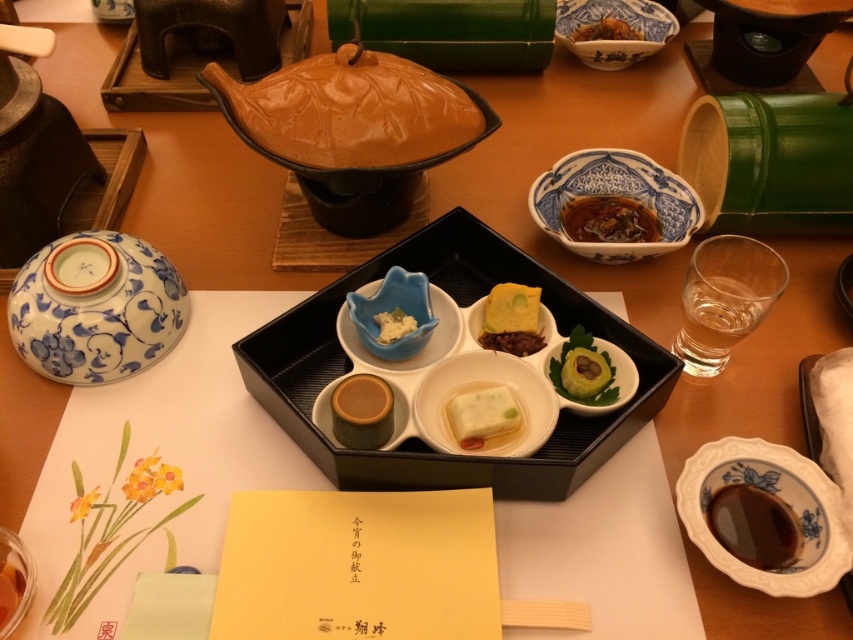
Does point (0, 596) lie behind point (0, 588)?

No, it is not.

Who is lower down, matte ceramic bowl at lower left or translucent glass at lower left?

translucent glass at lower left is lower down.

Who is more forward, (27, 564) or (4, 563)?

Point (27, 564) is in front.

You are a GUI agent. You are given a task and a screenshot of the screen. Output one action in this format:
    pyautogui.click(x=<x>, y=<y>)
    Task: Click on the matte ceramic bowl at lower left
    
    Given the screenshot: What is the action you would take?
    pyautogui.click(x=13, y=580)

What do you see at coordinates (363, 412) in the screenshot?
I see `matte brown cylinder at center` at bounding box center [363, 412].

Is matte brown cylinder at center shorter than green leafy garnish at center?

Yes.

This screenshot has height=640, width=853. I want to click on matte brown cylinder at center, so click(x=363, y=412).

Between blue porcelain bowl at left and white porcelain dish at center, which one is positioned higher?

blue porcelain bowl at left is higher up.

At what (x,y) coordinates should I click in order to perform the action: click on blue porcelain bowl at left. Please return your answer as a coordinate pair (x, y). Looking at the image, I should click on (96, 307).

At what (x,y) coordinates should I click in order to perform the action: click on blue porcelain bowl at left. Please return your answer as a coordinate pair (x, y). Looking at the image, I should click on (96, 307).